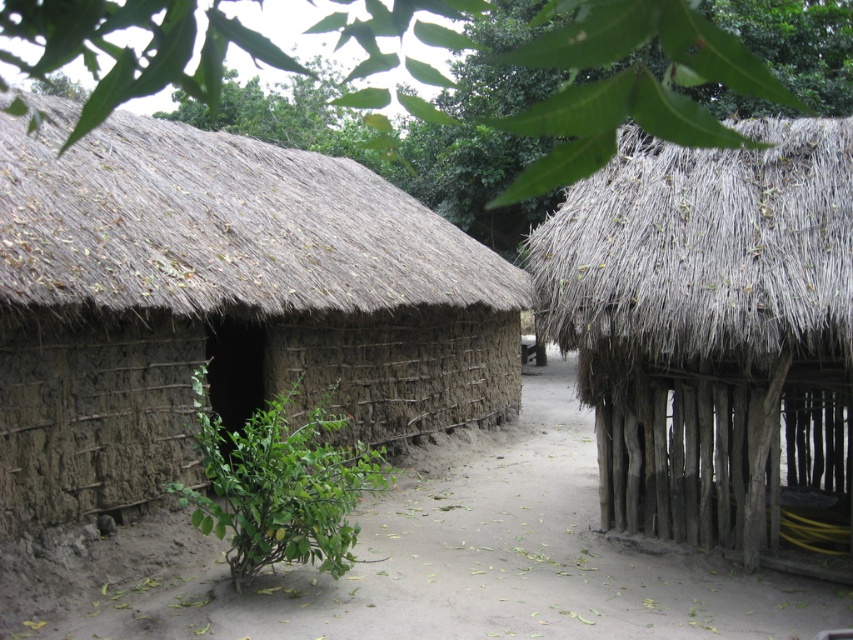
You are planning to build a new shed in your backyard and want to ensure it won t block sunlight from reaching your garden. You have two existing structures in the image. Which structure, the thatched straw hut at center or the brown thatch roof at left, is located in a position that might cast a shadow over the garden if placed in the same orientation?

The thatched straw hut at center is positioned under the brown thath roof at left, so the brown thath roof at left is higher and would cast a larger shadow over the garden.

You are a traveler planning to enter the thatched straw hut at center and the brown thatch roof at left. Based on their heights, which structure would require you to bend lower to avoid hitting your head?

The brown thatch roof at left has a smaller height compared to the thatched straw hut at center, so you would need to bend lower when entering the brown thatch roof at left to avoid hitting your head.

You are standing in the middle of the rural scene looking at the two huts. Which direction should you walk to reach the thatched straw hut at center from the brown thatch roof at left?

To reach the thatched straw hut at center from the brown thath roof at left, you should walk to the right since the thatched straw hut at center is located to the right of the brown thath roof at left.